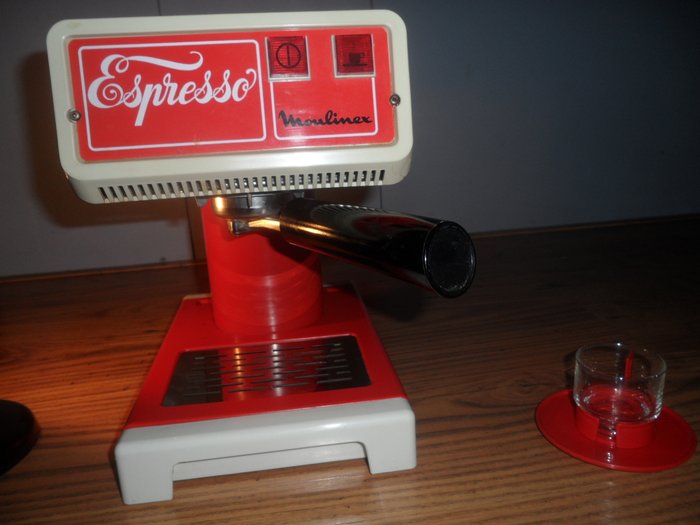
Locate an element on the screen. This screenshot has height=525, width=700. handle is located at coordinates (396, 240).